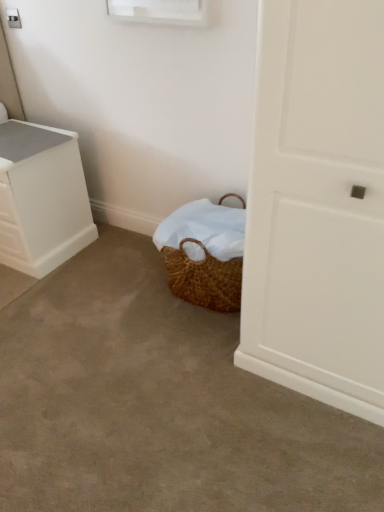
Measure the distance between brown woven basket at lower center and camera.

1.20 meters.

This screenshot has height=512, width=384. Describe the element at coordinates (158, 403) in the screenshot. I see `brown woven basket at lower center` at that location.

Where is `brown woven basket at lower center`? brown woven basket at lower center is located at coordinates (158, 403).

This screenshot has height=512, width=384. What do you see at coordinates (44, 206) in the screenshot?
I see `white plastic chest of drawers at left` at bounding box center [44, 206].

Identify the location of white plastic chest of drawers at left. (44, 206).

Measure the distance between point (33, 230) and camera.

They are 1.98 meters apart.

Image resolution: width=384 pixels, height=512 pixels. In order to click on brown woven basket at lower center in this screenshot , I will do (158, 403).

Would you say brown woven basket at lower center is to the left or to the right of white plastic chest of drawers at left in the picture?

From the image, it's evident that brown woven basket at lower center is to the right of white plastic chest of drawers at left.

Does brown woven basket at lower center lie behind white plastic chest of drawers at left?

No, the depth of brown woven basket at lower center is less than that of white plastic chest of drawers at left.

Which is behind, point (5, 307) or point (49, 165)?

The point (49, 165) is farther.

From the picture: From the image's perspective, is brown woven basket at lower center located above or below white plastic chest of drawers at left?

Based on their image positions, brown woven basket at lower center is located beneath white plastic chest of drawers at left.

From a real-world perspective, is brown woven basket at lower center beneath white plastic chest of drawers at left?

Yes.

Which object is wider, brown woven basket at lower center or white plastic chest of drawers at left?

brown woven basket at lower center is wider.

Can you confirm if brown woven basket at lower center is shorter than white plastic chest of drawers at left?

Result: Yes.

Considering the sizes of objects brown woven basket at lower center and white plastic chest of drawers at left in the image provided, who is bigger, brown woven basket at lower center or white plastic chest of drawers at left?

brown woven basket at lower center.

Is white plastic chest of drawers at left inside brown woven basket at lower center?

No, white plastic chest of drawers at left is not inside brown woven basket at lower center.

From the picture: Is brown woven basket at lower center next to white plastic chest of drawers at left?

No, brown woven basket at lower center is not touching white plastic chest of drawers at left.

Is white plastic chest of drawers at left at the back of brown woven basket at lower center?

No, brown woven basket at lower center is not facing the opposite direction of white plastic chest of drawers at left.

How different are the orientations of brown woven basket at lower center and white plastic chest of drawers at left in degrees?

1.22 degrees separate the facing orientations of brown woven basket at lower center and white plastic chest of drawers at left.

How much distance is there between brown woven basket at lower center and white plastic chest of drawers at left?

brown woven basket at lower center and white plastic chest of drawers at left are 26.66 inches apart from each other.

Locate an element on the screen. the chest of drawers above the brown woven basket at lower center (from a real-world perspective) is located at coordinates (44, 206).

Considering the positions of objects white plastic chest of drawers at left and brown woven basket at lower center in the image provided, who is more to the left, white plastic chest of drawers at left or brown woven basket at lower center?

white plastic chest of drawers at left.

Is white plastic chest of drawers at left closer to camera compared to brown woven basket at lower center?

That is False.

Considering the positions of point (26, 162) and point (131, 486), is point (26, 162) closer or farther from the camera than point (131, 486)?

Point (26, 162).

From the image's perspective, is white plastic chest of drawers at left located beneath brown woven basket at lower center?

Actually, white plastic chest of drawers at left appears above brown woven basket at lower center in the image.

From a real-world perspective, who is located higher, white plastic chest of drawers at left or brown woven basket at lower center?

white plastic chest of drawers at left is physically above.

Between white plastic chest of drawers at left and brown woven basket at lower center, which one has smaller width?

white plastic chest of drawers at left.

Considering the relative sizes of white plastic chest of drawers at left and brown woven basket at lower center in the image provided, is white plastic chest of drawers at left taller than brown woven basket at lower center?

Yes, white plastic chest of drawers at left is taller than brown woven basket at lower center.

Can you confirm if white plastic chest of drawers at left is smaller than brown woven basket at lower center?

Yes, white plastic chest of drawers at left is smaller than brown woven basket at lower center.

Is white plastic chest of drawers at left inside the boundaries of brown woven basket at lower center, or outside?

white plastic chest of drawers at left cannot be found inside brown woven basket at lower center.

Are white plastic chest of drawers at left and brown woven basket at lower center far apart?

That's not correct — white plastic chest of drawers at left is a little close to brown woven basket at lower center.

Is brown woven basket at lower center at the back of white plastic chest of drawers at left?

No, white plastic chest of drawers at left is not facing away from brown woven basket at lower center.

Identify the location of concrete lying in front of the white plastic chest of drawers at left. The width and height of the screenshot is (384, 512). click(158, 403).

Where is `the chest of drawers above the brown woven basket at lower center (from the image's perspective)`? The height and width of the screenshot is (512, 384). the chest of drawers above the brown woven basket at lower center (from the image's perspective) is located at coordinates coord(44,206).

Where is `concrete beneath the white plastic chest of drawers at left (from a real-world perspective)`? This screenshot has height=512, width=384. concrete beneath the white plastic chest of drawers at left (from a real-world perspective) is located at coordinates (158, 403).